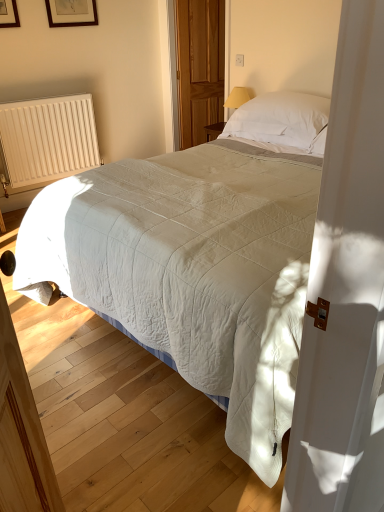
Find the location of a particular element. The height and width of the screenshot is (512, 384). white ribbed radiator at left is located at coordinates (47, 139).

You are a GUI agent. You are given a task and a screenshot of the screen. Output one action in this format:
    pyautogui.click(x=<x>, y=<y>)
    Task: Click on the wooden screen door at center
    
    Given the screenshot: What is the action you would take?
    pyautogui.click(x=199, y=67)

Describe the element at coordinates (199, 67) in the screenshot. This screenshot has width=384, height=512. I see `wooden screen door at center` at that location.

Measure the distance between wooden picture frame at upper left and camera.

A distance of 3.44 meters exists between wooden picture frame at upper left and camera.

The width and height of the screenshot is (384, 512). I want to click on white ribbed radiator at left, so click(x=47, y=139).

Are white soft pillow at upper center and wooden screen door at center far apart?

white soft pillow at upper center is positioned a significant distance from wooden screen door at center.

Between white soft pillow at upper center and wooden screen door at center, which one has larger size?

With larger size is white soft pillow at upper center.

At what (x,y) coordinates should I click in order to perform the action: click on pillow on the right of wooden screen door at center. Please return your answer as a coordinate pair (x, y). The width and height of the screenshot is (384, 512). Looking at the image, I should click on (282, 121).

Considering the relative sizes of white soft pillow at upper center and wooden screen door at center in the image provided, is white soft pillow at upper center wider than wooden screen door at center?

Yes, white soft pillow at upper center is wider than wooden screen door at center.

Looking at this image, which of these two, white quilted bed at center or white soft pillow at upper center, is smaller?

Smaller between the two is white soft pillow at upper center.

Considering the relative positions of white quilted bed at center and white soft pillow at upper center in the image provided, is white quilted bed at center to the right of white soft pillow at upper center from the viewer's perspective?

Incorrect, white quilted bed at center is not on the right side of white soft pillow at upper center.

From the image's perspective, which is below, white quilted bed at center or white soft pillow at upper center?

white quilted bed at center is shown below in the image.

Is white quilted bed at center at the back of white soft pillow at upper center?

No, white quilted bed at center is not at the back of white soft pillow at upper center.

In the scene shown: Is white soft pillow at upper center not inside white quilted bed at center?

Yes, white soft pillow at upper center is located beyond the bounds of white quilted bed at center.

In the image, there is a white soft pillow at upper center. Where is `bed below it (from a real-world perspective)`? bed below it (from a real-world perspective) is located at coordinates (192, 270).

Which of these two, white soft pillow at upper center or white quilted bed at center, stands taller?

Standing taller between the two is white quilted bed at center.

From a real-world perspective, is white quilted bed at center physically located above or below wooden picture frame at upper left?

From a real-world perspective, white quilted bed at center is physically below wooden picture frame at upper left.

From the image's perspective, which is below, white quilted bed at center or wooden picture frame at upper left?

white quilted bed at center is shown below in the image.

Is white quilted bed at center not inside wooden picture frame at upper left?

Yes.

Does white quilted bed at center touch wooden picture frame at upper left?

No, white quilted bed at center is not in contact with wooden picture frame at upper left.

Is white quilted bed at center at the right side of wooden screen door at center?

Correct, you'll find white quilted bed at center to the right of wooden screen door at center.

From the picture: Can you tell me how much white quilted bed at center and wooden screen door at center differ in facing direction?

74.4 degrees.

From the image's perspective, is white quilted bed at center located beneath wooden screen door at center?

Yes, from the image's perspective, white quilted bed at center is below wooden screen door at center.

Is white quilted bed at center in front of wooden screen door at center?

That is True.

How many degrees apart are the facing directions of white ribbed radiator at left and wooden picture frame at upper left?

The angular difference between white ribbed radiator at left and wooden picture frame at upper left is 0.87 degrees.

Is wooden picture frame at upper left inside white ribbed radiator at left?

Actually, wooden picture frame at upper left is outside white ribbed radiator at left.

Is point (30, 178) positioned before point (49, 7)?

No, it is not.

Considering the sizes of white ribbed radiator at left and wooden picture frame at upper left in the image, is white ribbed radiator at left bigger or smaller than wooden picture frame at upper left?

Clearly, white ribbed radiator at left is larger in size than wooden picture frame at upper left.

Is wooden picture frame at upper left shorter than white quilted bed at center?

Yes.

Which is less distant, (84, 2) or (132, 252)?

Point (84, 2) is farther from the camera than point (132, 252).

From a real-world perspective, is wooden picture frame at upper left over white quilted bed at center?

Indeed, from a real-world perspective, wooden picture frame at upper left stands above white quilted bed at center.

Could you tell me if wooden picture frame at upper left is facing white quilted bed at center?

No.

Find the location of `pillow below the wooden screen door at center (from a real-world perspective)`. pillow below the wooden screen door at center (from a real-world perspective) is located at coordinates (282, 121).

In order to click on bed on the left of the white soft pillow at upper center in this screenshot , I will do `click(192, 270)`.

Considering their positions, is white ribbed radiator at left positioned further to wooden screen door at center than wooden picture frame at upper left?

The object further to wooden screen door at center is white ribbed radiator at left.

Estimate the real-world distances between objects in this image. Which object is further from white ribbed radiator at left, wooden screen door at center or white soft pillow at upper center?

Based on the image, white soft pillow at upper center appears to be further to white ribbed radiator at left.

Looking at this image, which object lies nearer to the anchor point wooden screen door at center, white quilted bed at center or white ribbed radiator at left?

white ribbed radiator at left.

Considering their positions, is white ribbed radiator at left positioned further to wooden picture frame at upper left than white soft pillow at upper center?

white soft pillow at upper center lies further to wooden picture frame at upper left than the other object.

Based on the photo, which object lies further to the anchor point white soft pillow at upper center, white quilted bed at center or wooden picture frame at upper left?

wooden picture frame at upper left.

When comparing their distances from white ribbed radiator at left, does white soft pillow at upper center or wooden screen door at center seem closer?

wooden screen door at center is positioned closer to the anchor white ribbed radiator at left.

When comparing their distances from white quilted bed at center, does white soft pillow at upper center or wooden screen door at center seem further?

wooden screen door at center lies further to white quilted bed at center than the other object.

Estimate the real-world distances between objects in this image. Which object is closer to wooden screen door at center, white ribbed radiator at left or white quilted bed at center?

Based on the image, white ribbed radiator at left appears to be nearer to wooden screen door at center.

Locate an element on the screen. radiator between white quilted bed at center and wooden picture frame at upper left in the front-back direction is located at coordinates (47, 139).

Locate an element on the screen. The height and width of the screenshot is (512, 384). picture frame situated between white ribbed radiator at left and wooden screen door at center from left to right is located at coordinates (71, 13).

This screenshot has height=512, width=384. I want to click on radiator between white quilted bed at center and wooden screen door at center from front to back, so click(47, 139).

Image resolution: width=384 pixels, height=512 pixels. In order to click on screen door situated between wooden picture frame at upper left and white soft pillow at upper center from left to right in this screenshot , I will do `click(199, 67)`.